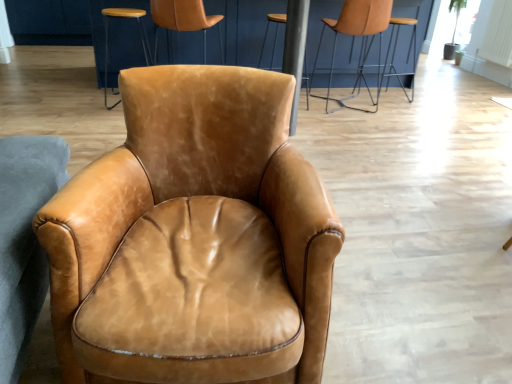
You are a GUI agent. You are given a task and a screenshot of the screen. Output one action in this format:
    pyautogui.click(x=<x>, y=<y>)
    Task: Click on the vacant point to the right of saddle brown leather armchair at center, the first chair positioned from the front
    The image size is (512, 384).
    Given the screenshot: What is the action you would take?
    pyautogui.click(x=402, y=297)